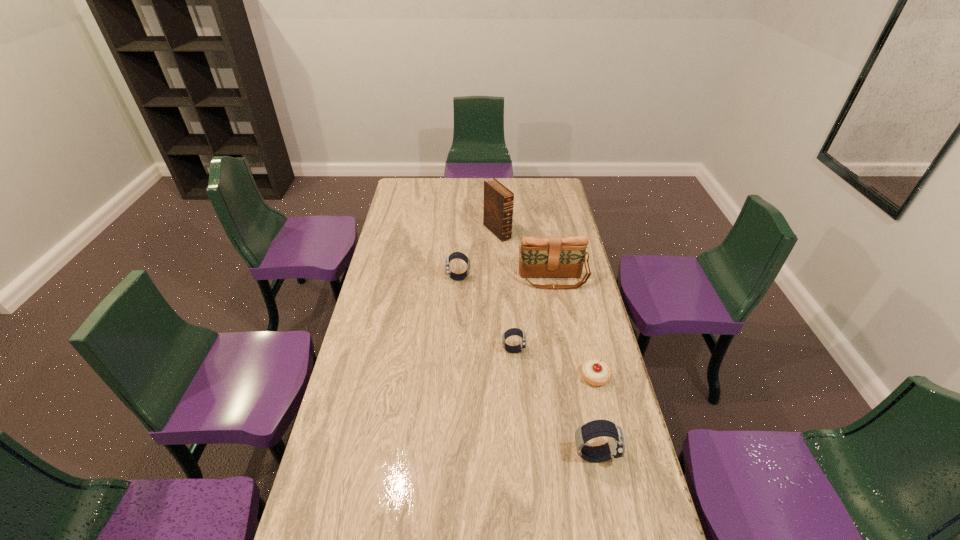
At what (x,y) coordinates should I click in order to perform the action: click on vacant spot to place a watch on the left. Please return your answer as a coordinate pair (x, y). Image resolution: width=960 pixels, height=540 pixels. Looking at the image, I should click on (418, 226).